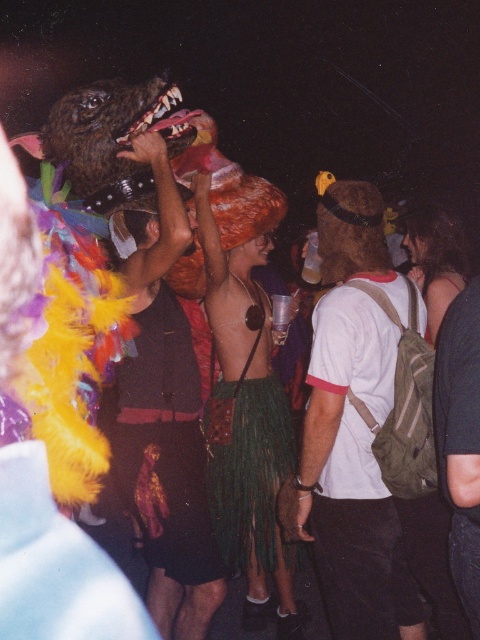
Between white matte t-shirt at center and fuzzy costume at center, which one appears on the right side from the viewer's perspective?

From the viewer's perspective, white matte t-shirt at center appears more on the right side.

Who is positioned more to the left, white matte t-shirt at center or fuzzy costume at center?

Positioned to the left is fuzzy costume at center.

Locate an element on the screen. Image resolution: width=480 pixels, height=640 pixels. white matte t-shirt at center is located at coordinates (351, 429).

What are the coordinates of `white matte t-shirt at center` in the screenshot? It's located at (351, 429).

Does white matte t-shirt at center appear over green fringed skirt at center?

Yes.

From the picture: Can you confirm if white matte t-shirt at center is taller than green fringed skirt at center?

In fact, white matte t-shirt at center may be shorter than green fringed skirt at center.

Measure the distance between white matte t-shirt at center and camera.

white matte t-shirt at center is 7.80 feet from camera.

This screenshot has width=480, height=640. What are the coordinates of `white matte t-shirt at center` in the screenshot? It's located at (351, 429).

Measure the distance between fuzzy costume at center and green fringed skirt at center.

They are 15.71 inches apart.

Can you confirm if fuzzy costume at center is positioned above green fringed skirt at center?

Yes.

What do you see at coordinates (165, 416) in the screenshot?
I see `fuzzy costume at center` at bounding box center [165, 416].

This screenshot has width=480, height=640. What are the coordinates of `fuzzy costume at center` in the screenshot? It's located at (165, 416).